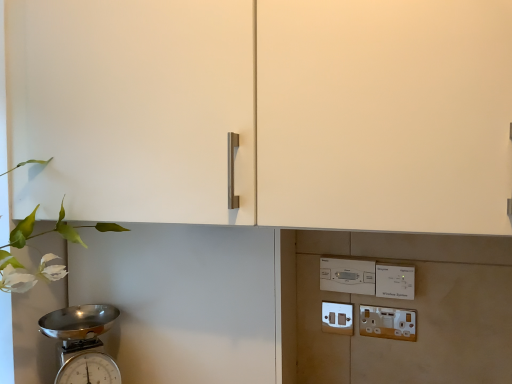
Identify the location of white plastic light switch at lower right, arranged as the 2th light switch when viewed from the left. The height and width of the screenshot is (384, 512). (395, 281).

Measure the distance between point (322, 325) and camera.

1.22 meters.

What is the approximate height of white plastic light switch at center, which is the second light switch in right-to-left order?

3.65 inches.

Locate an element on the screen. white plastic light switch at lower right, the first light switch positioned from the right is located at coordinates (395, 281).

Looking at this image, which is correct: white plastic light switch at center, which is counted as the first light switch, starting from the left, is inside white plastic electric outlet at lower right, positioned as the 1th electric outlet in front-to-back order, or outside of it?

white plastic light switch at center, which is counted as the first light switch, starting from the left, cannot be found inside white plastic electric outlet at lower right, positioned as the 1th electric outlet in front-to-back order.

Consider the image. Is white plastic light switch at center, which is the second light switch in right-to-left order, positioned with its back to white plastic electric outlet at lower right, which is the second electric outlet in left-to-right order?

white plastic light switch at center, which is the second light switch in right-to-left order, does not have its back to white plastic electric outlet at lower right, which is the second electric outlet in left-to-right order.

Is white plastic light switch at center, which is counted as the first light switch, starting from the left, far away from white plastic electric outlet at lower right, arranged as the 2th electric outlet when viewed from the back?

No, white plastic light switch at center, which is counted as the first light switch, starting from the left, is not far away from white plastic electric outlet at lower right, arranged as the 2th electric outlet when viewed from the back.

From a real-world perspective, is white plastic light switch at center, which is counted as the first light switch, starting from the left, under white plastic electric outlet at lower right, which is the second electric outlet in left-to-right order?

No.

Considering the positions of points (409, 289) and (88, 351), is point (409, 289) closer to camera compared to point (88, 351)?

Yes, point (409, 289) is closer to viewer.

From a real-world perspective, does white plastic light switch at lower right, arranged as the 2th light switch when viewed from the left, sit lower than shiny metallic scale at lower left?

No, from a real-world perspective, white plastic light switch at lower right, arranged as the 2th light switch when viewed from the left, is not under shiny metallic scale at lower left.

Is white plastic light switch at lower right, the first light switch positioned from the right, in contact with shiny metallic scale at lower left?

white plastic light switch at lower right, the first light switch positioned from the right, and shiny metallic scale at lower left are not in contact.

Visually, is white plastic light switch at lower right, arranged as the 2th light switch when viewed from the left, positioned to the left or to the right of shiny metallic scale at lower left?

Clearly, white plastic light switch at lower right, arranged as the 2th light switch when viewed from the left, is on the right of shiny metallic scale at lower left in the image.

Considering the points (408, 320) and (65, 368), which point is behind, point (408, 320) or point (65, 368)?

Positioned behind is point (408, 320).

Would you say white plastic electric outlet at lower right, arranged as the 2th electric outlet when viewed from the back, is outside shiny metallic scale at lower left?

Absolutely, white plastic electric outlet at lower right, arranged as the 2th electric outlet when viewed from the back, is external to shiny metallic scale at lower left.

How many degrees apart are the facing directions of white plastic electric outlet at lower right, which is the second electric outlet in left-to-right order, and shiny metallic scale at lower left?

The angle between the facing direction of white plastic electric outlet at lower right, which is the second electric outlet in left-to-right order, and the facing direction of shiny metallic scale at lower left is 53.3 degrees.

Does white plastic electric outlet at lower right, positioned as the 1th electric outlet in front-to-back order, lie in front of shiny metallic scale at lower left?

No, white plastic electric outlet at lower right, positioned as the 1th electric outlet in front-to-back order, is behind shiny metallic scale at lower left.

Consider the image. Measure the distance between white plastic electric outlet at lower right, positioned as the 1th electric outlet in front-to-back order, and white plastic light switch at center, which is the second light switch in right-to-left order.

A: white plastic electric outlet at lower right, positioned as the 1th electric outlet in front-to-back order, and white plastic light switch at center, which is the second light switch in right-to-left order, are 4.25 inches apart from each other.

Is white plastic electric outlet at lower right, arranged as the 2th electric outlet when viewed from the back, aimed at white plastic light switch at center, which is counted as the first light switch, starting from the left?

No, white plastic electric outlet at lower right, arranged as the 2th electric outlet when viewed from the back, is not turned towards white plastic light switch at center, which is counted as the first light switch, starting from the left.

Is white plastic electric outlet at lower right, marked as the 1th electric outlet in a right-to-left arrangement, inside the boundaries of white plastic light switch at center, which is the second light switch in right-to-left order, or outside?

white plastic electric outlet at lower right, marked as the 1th electric outlet in a right-to-left arrangement, is not inside white plastic light switch at center, which is the second light switch in right-to-left order, it's outside.

From the picture: From the image's perspective, which one is positioned lower, white plastic electric outlet at lower right, arranged as the 2th electric outlet when viewed from the back, or white plastic light switch at center, which is counted as the first light switch, starting from the left?

white plastic electric outlet at lower right, arranged as the 2th electric outlet when viewed from the back, appears lower in the image.

Is white plastic light switch at lower right, arranged as the 2th light switch when viewed from the left, closer to the viewer compared to matte white switch at lower center, which appears as the 2th electric outlet when viewed from the right?

Yes, white plastic light switch at lower right, arranged as the 2th light switch when viewed from the left, is in front of matte white switch at lower center, which appears as the 2th electric outlet when viewed from the right.

From a real-world perspective, does white plastic light switch at lower right, the first light switch positioned from the right, stand above matte white switch at lower center, acting as the 2th electric outlet starting from the front?

Yes, from a real-world perspective, white plastic light switch at lower right, the first light switch positioned from the right, is on top of matte white switch at lower center, acting as the 2th electric outlet starting from the front.

Is white plastic light switch at lower right, the first light switch positioned from the right, bigger or smaller than matte white switch at lower center, which is the 1th electric outlet from left to right?

Considering their sizes, white plastic light switch at lower right, the first light switch positioned from the right, takes up more space than matte white switch at lower center, which is the 1th electric outlet from left to right.

Which of these two, white plastic light switch at lower right, the first light switch positioned from the right, or matte white switch at lower center, acting as the 2th electric outlet starting from the front, is wider?

white plastic light switch at lower right, the first light switch positioned from the right, is wider.

From the image's perspective, starting from the white plastic light switch at center, which is counted as the first light switch, starting from the left, which electric outlet is the 1st one below? Please provide its 2D coordinates.

[(337, 318)]

Can you confirm if matte white switch at lower center, the first electric outlet in the back-to-front sequence, is positioned to the left of white plastic light switch at center, which is counted as the first light switch, starting from the left?

Yes, matte white switch at lower center, the first electric outlet in the back-to-front sequence, is to the left of white plastic light switch at center, which is counted as the first light switch, starting from the left.

Considering the sizes of objects matte white switch at lower center, which appears as the 2th electric outlet when viewed from the right, and white plastic light switch at center, which is the second light switch in right-to-left order, in the image provided, who is taller, matte white switch at lower center, which appears as the 2th electric outlet when viewed from the right, or white plastic light switch at center, which is the second light switch in right-to-left order,?

Standing taller between the two is white plastic light switch at center, which is the second light switch in right-to-left order.

Is matte white switch at lower center, which appears as the 2th electric outlet when viewed from the right, situated inside white plastic light switch at center, which is counted as the first light switch, starting from the left, or outside?

matte white switch at lower center, which appears as the 2th electric outlet when viewed from the right, cannot be found inside white plastic light switch at center, which is counted as the first light switch, starting from the left.

Looking at this image, considering the relative sizes of matte white switch at lower center, acting as the 2th electric outlet starting from the front, and white plastic electric outlet at lower right, marked as the 1th electric outlet in a right-to-left arrangement, in the image provided, is matte white switch at lower center, acting as the 2th electric outlet starting from the front, bigger than white plastic electric outlet at lower right, marked as the 1th electric outlet in a right-to-left arrangement,?

No.

Is matte white switch at lower center, which is the 1th electric outlet from left to right, to the right of white plastic electric outlet at lower right, positioned as the 1th electric outlet in front-to-back order, from the viewer's perspective?

In fact, matte white switch at lower center, which is the 1th electric outlet from left to right, is to the left of white plastic electric outlet at lower right, positioned as the 1th electric outlet in front-to-back order.

Is matte white switch at lower center, which is the 1th electric outlet from left to right, shorter than white plastic electric outlet at lower right, positioned as the 1th electric outlet in front-to-back order?

No.

From the image's perspective, between matte white switch at lower center, which is the 1th electric outlet from left to right, and white plastic electric outlet at lower right, positioned as the 1th electric outlet in front-to-back order, who is located below?

From the image's view, white plastic electric outlet at lower right, positioned as the 1th electric outlet in front-to-back order, is below.

From the image's perspective, which light switch is the 2nd one above the white plastic electric outlet at lower right, which is the second electric outlet in left-to-right order? Please provide its 2D coordinates.

[(347, 275)]

Identify the location of scale lying on the left of white plastic light switch at lower right, the first light switch positioned from the right. (82, 343).

Based on their spatial positions, is matte white switch at lower center, the first electric outlet in the back-to-front sequence, or white plastic light switch at lower right, the first light switch positioned from the right, further from shiny metallic scale at lower left?

white plastic light switch at lower right, the first light switch positioned from the right, is further to shiny metallic scale at lower left.

In the scene shown: Looking at the image, which one is located further to shiny metallic scale at lower left, white plastic light switch at lower right, arranged as the 2th light switch when viewed from the left, or white plastic electric outlet at lower right, arranged as the 2th electric outlet when viewed from the back?

white plastic light switch at lower right, arranged as the 2th light switch when viewed from the left, is further to shiny metallic scale at lower left.

Estimate the real-world distances between objects in this image. Which object is closer to matte white switch at lower center, the first electric outlet in the back-to-front sequence, white plastic light switch at lower right, arranged as the 2th light switch when viewed from the left, or white plastic light switch at center, which is counted as the first light switch, starting from the left?

The object closer to matte white switch at lower center, the first electric outlet in the back-to-front sequence, is white plastic light switch at center, which is counted as the first light switch, starting from the left.

Considering their positions, is shiny metallic scale at lower left positioned closer to matte white switch at lower center, the first electric outlet in the back-to-front sequence, than white plastic light switch at center, which is the second light switch in right-to-left order?

Among the two, white plastic light switch at center, which is the second light switch in right-to-left order, is located nearer to matte white switch at lower center, the first electric outlet in the back-to-front sequence.

Looking at the image, which one is located further to white plastic light switch at lower right, the first light switch positioned from the right, white plastic electric outlet at lower right, positioned as the 1th electric outlet in front-to-back order, or shiny metallic scale at lower left?

shiny metallic scale at lower left is further to white plastic light switch at lower right, the first light switch positioned from the right.

Looking at the image, which one is located closer to shiny metallic scale at lower left, white plastic light switch at lower right, the first light switch positioned from the right, or matte white switch at lower center, acting as the 2th electric outlet starting from the front?

Based on the image, matte white switch at lower center, acting as the 2th electric outlet starting from the front, appears to be nearer to shiny metallic scale at lower left.

Looking at the image, which one is located closer to shiny metallic scale at lower left, white plastic electric outlet at lower right, which is the second electric outlet in left-to-right order, or white plastic light switch at center, which is counted as the first light switch, starting from the left?

Based on the image, white plastic light switch at center, which is counted as the first light switch, starting from the left, appears to be nearer to shiny metallic scale at lower left.

From the picture: From the image, which object appears to be farther from white plastic electric outlet at lower right, positioned as the 1th electric outlet in front-to-back order, white plastic light switch at center, which is counted as the first light switch, starting from the left, or white plastic light switch at lower right, the first light switch positioned from the right?

white plastic light switch at center, which is counted as the first light switch, starting from the left, is positioned further to the anchor white plastic electric outlet at lower right, positioned as the 1th electric outlet in front-to-back order.

Locate an element on the screen. Image resolution: width=512 pixels, height=384 pixels. light switch between white plastic light switch at center, which is counted as the first light switch, starting from the left, and white plastic electric outlet at lower right, which is the second electric outlet in left-to-right order, in the vertical direction is located at coordinates (395, 281).

What are the coordinates of `electric outlet between shiny metallic scale at lower left and white plastic electric outlet at lower right, positioned as the 1th electric outlet in front-to-back order` in the screenshot? It's located at (337, 318).

Locate an element on the screen. Image resolution: width=512 pixels, height=384 pixels. electric outlet between shiny metallic scale at lower left and white plastic light switch at center, which is counted as the first light switch, starting from the left is located at coordinates (337, 318).

Locate an element on the screen. electric outlet between white plastic light switch at center, which is the second light switch in right-to-left order, and white plastic electric outlet at lower right, which is the second electric outlet in left-to-right order, in the up-down direction is located at coordinates (337, 318).